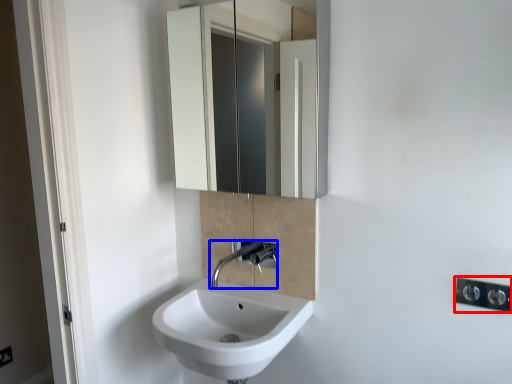
Question: Which of the following is the closest to the observer, light switch (highlighted by a red box) or tap (highlighted by a blue box)?

Choices:
 (A) light switch
 (B) tap

Answer: (A)